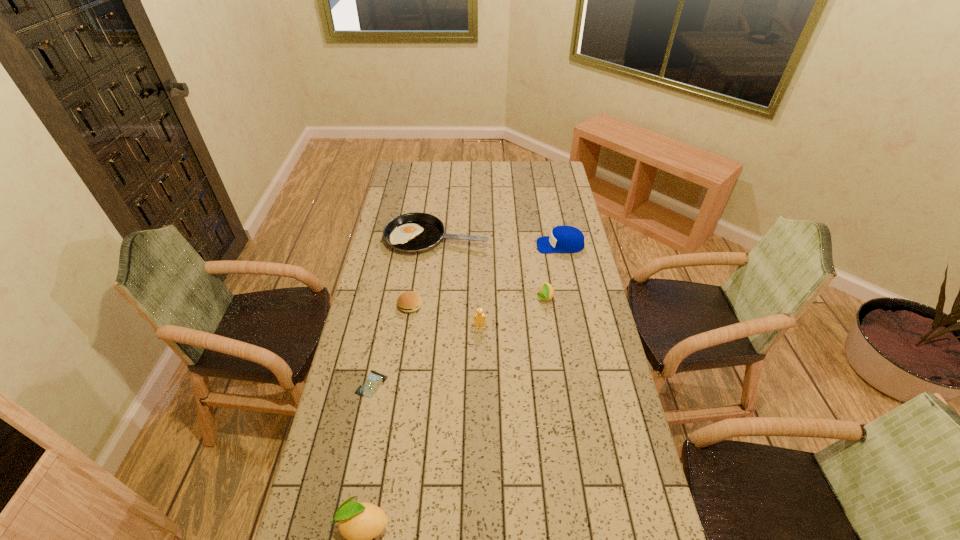
Locate an element on the screen. The image size is (960, 540). object identified as the fifth closest to the sixth farthest object is located at coordinates (546, 291).

Where is `vacant space that satisfies the following two spatial constraints: 1. on the front-facing side of the baseball cap; 2. on the face of the third nearest object`? This screenshot has width=960, height=540. vacant space that satisfies the following two spatial constraints: 1. on the front-facing side of the baseball cap; 2. on the face of the third nearest object is located at coordinates (577, 328).

I want to click on vacant space that satisfies the following two spatial constraints: 1. on the front-facing side of the baseball cap; 2. on the front side of the identity card, so click(x=588, y=384).